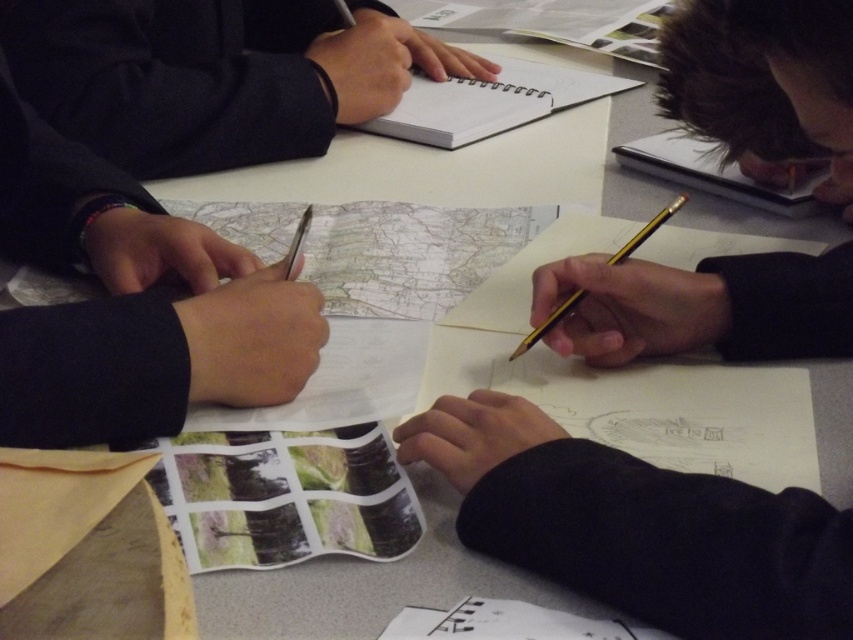
Does black matte pen at left appear on the right side of matte black notebook at upper left?

Incorrect, black matte pen at left is not on the right side of matte black notebook at upper left.

Can you confirm if black matte pen at left is positioned to the left of matte black notebook at upper left?

Indeed, black matte pen at left is positioned on the left side of matte black notebook at upper left.

What are the coordinates of `black matte pen at left` in the screenshot? It's located at (131, 304).

In the scene shown: Does black matte pen at left have a smaller size compared to dark brown hair at upper right?

No.

Which is behind, point (65, 186) or point (804, 163)?

Positioned behind is point (804, 163).

Image resolution: width=853 pixels, height=640 pixels. I want to click on black matte pen at left, so click(131, 304).

Measure the distance between dark brown hair at upper right and camera.

A distance of 14.62 inches exists between dark brown hair at upper right and camera.

Is point (770, 36) more distant than point (526, 340)?

No, it is in front of (526, 340).

Is point (757, 77) behind point (569, 300)?

No, (757, 77) is closer to viewer.

The image size is (853, 640). What are the coordinates of `dark brown hair at upper right` in the screenshot? It's located at (752, 76).